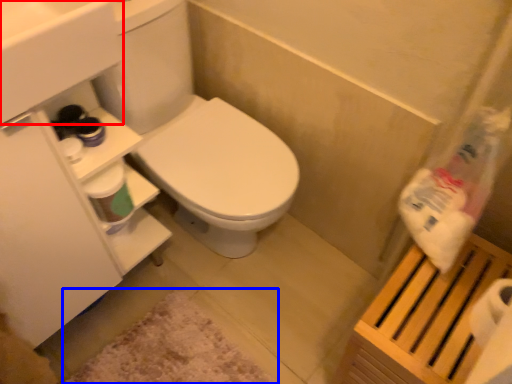
Question: Among these objects, which one is nearest to the camera, sink (highlighted by a red box) or bath mat (highlighted by a blue box)?

Choices:
 (A) sink
 (B) bath mat

Answer: (A)